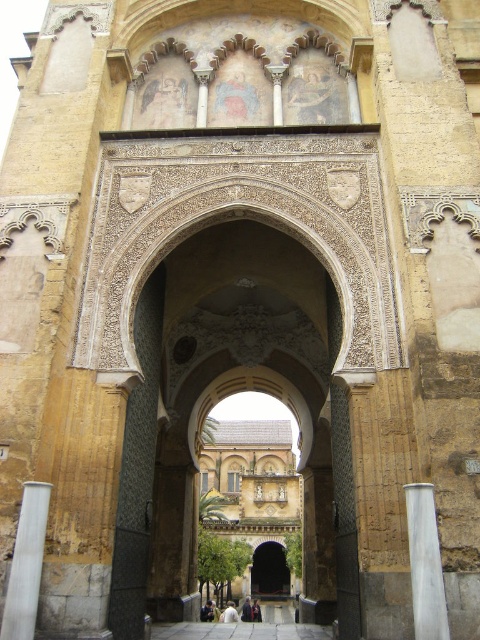
You are an architect inspecting the structure. You notice the white marble pillar at center and the dark brown wooden door at center. Which object is positioned higher in the image?

The white marble pillar at center is above the dark brown wooden door at center, so it is positioned higher in the image.